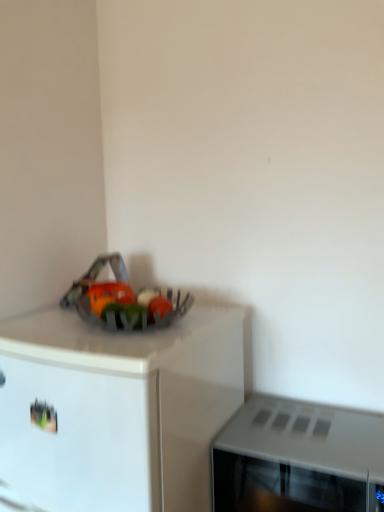
Question: Can you see metallic silver bowl at upper left touching gray matte microwave at right?

Choices:
 (A) yes
 (B) no

Answer: (B)

Question: Does metallic silver bowl at upper left appear on the left side of gray matte microwave at right?

Choices:
 (A) yes
 (B) no

Answer: (A)

Question: Could you tell me if metallic silver bowl at upper left is turned towards gray matte microwave at right?

Choices:
 (A) no
 (B) yes

Answer: (A)

Question: From a real-world perspective, is metallic silver bowl at upper left on gray matte microwave at right?

Choices:
 (A) no
 (B) yes

Answer: (A)

Question: Is metallic silver bowl at upper left to the right of gray matte microwave at right from the viewer's perspective?

Choices:
 (A) no
 (B) yes

Answer: (A)

Question: Is metallic silver bowl at upper left oriented away from gray matte microwave at right?

Choices:
 (A) no
 (B) yes

Answer: (A)

Question: Does gray matte microwave at right have a greater width compared to metallic silver bowl at upper left?

Choices:
 (A) yes
 (B) no

Answer: (B)

Question: Considering the relative sizes of gray matte microwave at right and metallic silver bowl at upper left in the image provided, is gray matte microwave at right shorter than metallic silver bowl at upper left?

Choices:
 (A) yes
 (B) no

Answer: (A)

Question: Is gray matte microwave at right facing away from metallic silver bowl at upper left?

Choices:
 (A) no
 (B) yes

Answer: (A)

Question: Is gray matte microwave at right outside metallic silver bowl at upper left?

Choices:
 (A) yes
 (B) no

Answer: (A)

Question: Does gray matte microwave at right have a larger size compared to metallic silver bowl at upper left?

Choices:
 (A) yes
 (B) no

Answer: (B)

Question: Does gray matte microwave at right have a lesser width compared to metallic silver bowl at upper left?

Choices:
 (A) yes
 (B) no

Answer: (A)

Question: Which is correct: metallic silver bowl at upper left is inside gray matte microwave at right, or outside of it?

Choices:
 (A) outside
 (B) inside

Answer: (A)